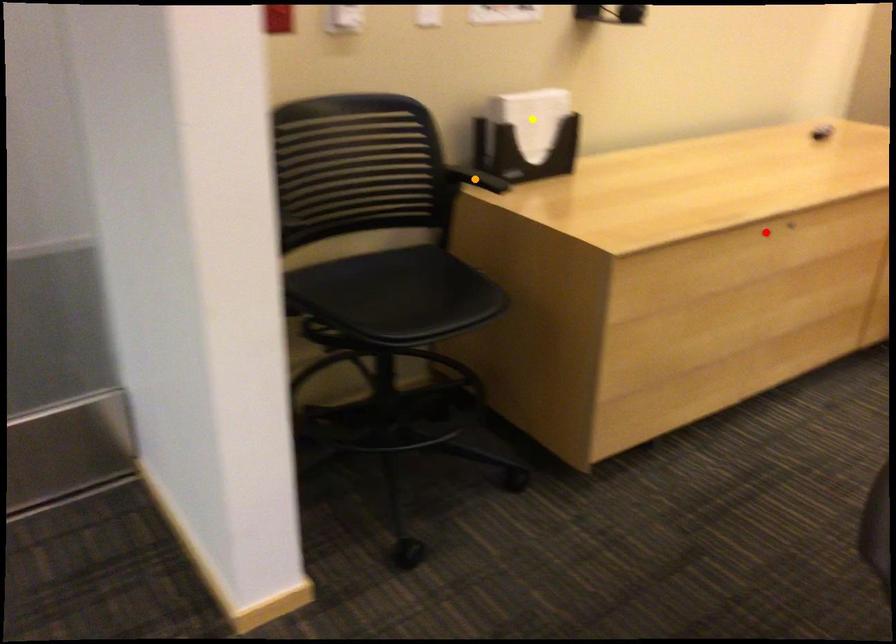
Order these from nearest to farthest:
A) red point
B) yellow point
C) orange point

orange point → red point → yellow point